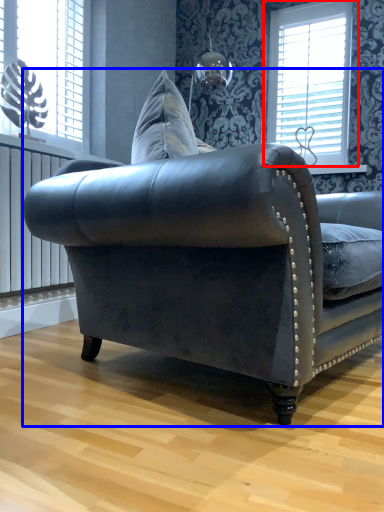
Question: Among these objects, which one is nearest to the camera, window (highlighted by a red box) or studio couch (highlighted by a blue box)?

Choices:
 (A) window
 (B) studio couch

Answer: (B)